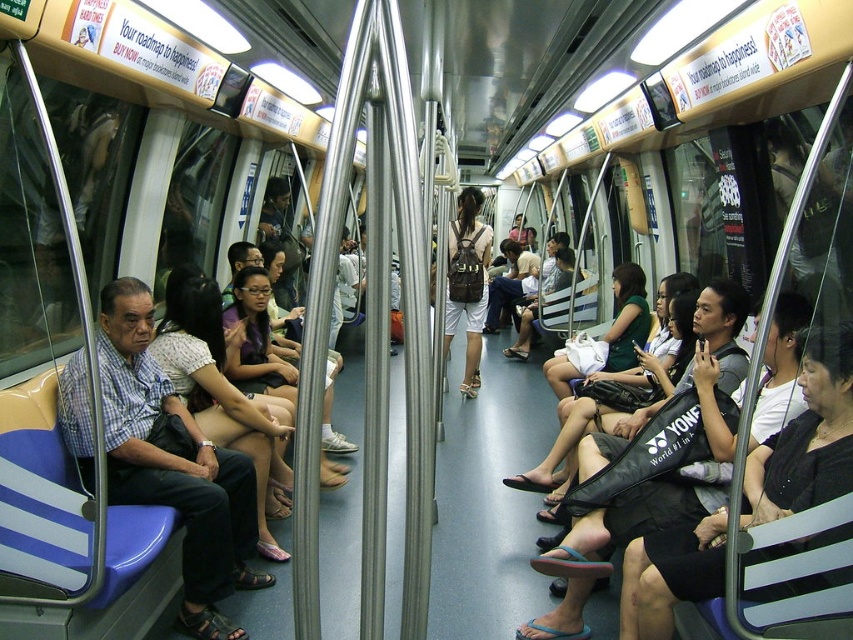
Is blue fabric seat at left smaller than black fabric bag at center?

Correct, blue fabric seat at left occupies less space than black fabric bag at center.

Between point (86, 449) and point (762, 484), which one is positioned behind?

The point (86, 449) is behind.

Describe the element at coordinates (173, 464) in the screenshot. The image size is (853, 640). I see `blue fabric seat at left` at that location.

At what (x,y) coordinates should I click in order to perform the action: click on blue fabric seat at left. Please return your answer as a coordinate pair (x, y). Looking at the image, I should click on (173, 464).

Which of these two, black fabric bag at center or matte white blouse at center, stands taller?

Standing taller between the two is matte white blouse at center.

Between black fabric bag at center and matte white blouse at center, which one is positioned lower?

black fabric bag at center

I want to click on black fabric bag at center, so click(x=807, y=436).

This screenshot has width=853, height=640. What are the coordinates of `black fabric bag at center` in the screenshot? It's located at (807, 436).

Is blue fabric seat at left thinner than matte white blouse at center?

No.

Who is more forward, (165, 506) or (241, 396)?

Point (165, 506) is more forward.

The width and height of the screenshot is (853, 640). I want to click on blue fabric seat at left, so click(x=173, y=464).